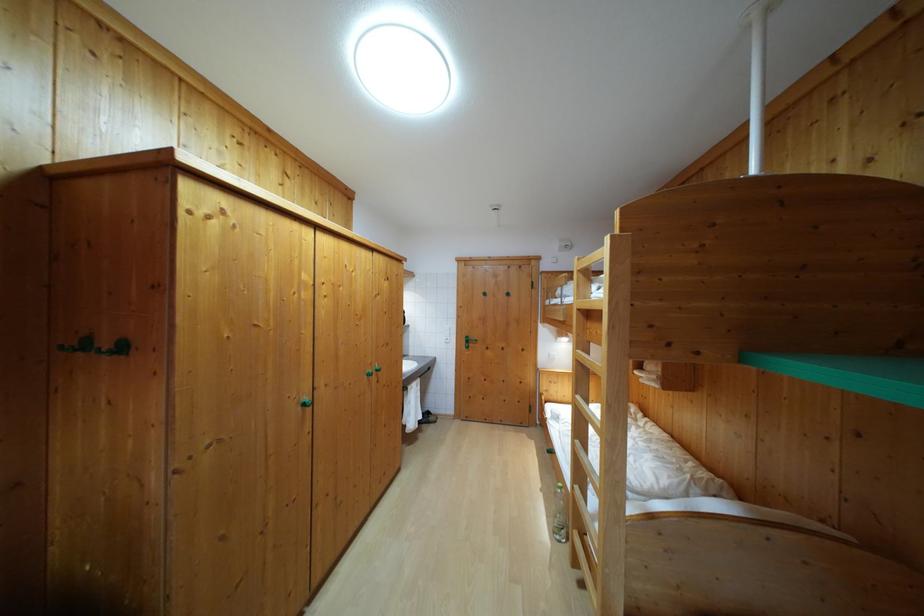
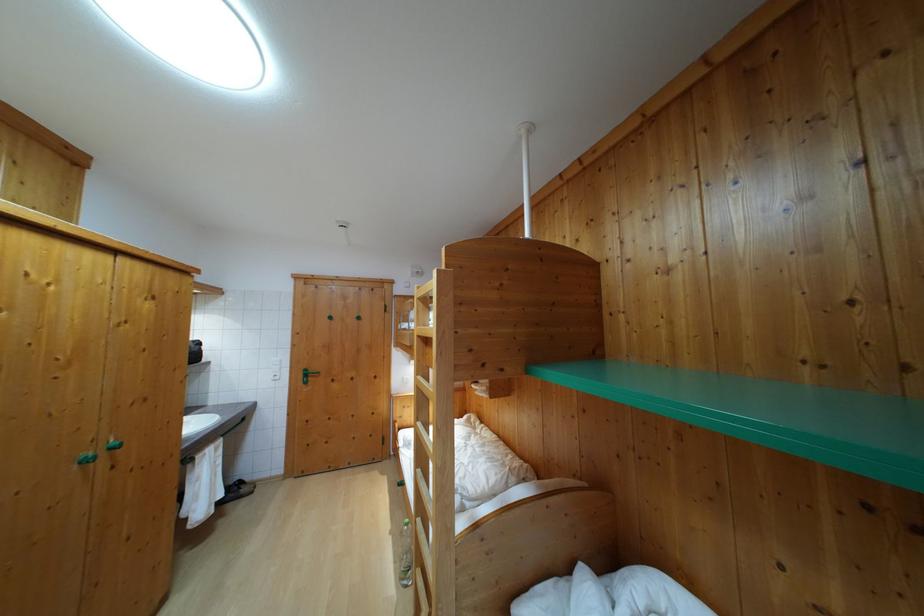
Find the pixel in the second image that matches [564,496] in the first image.

(410, 532)